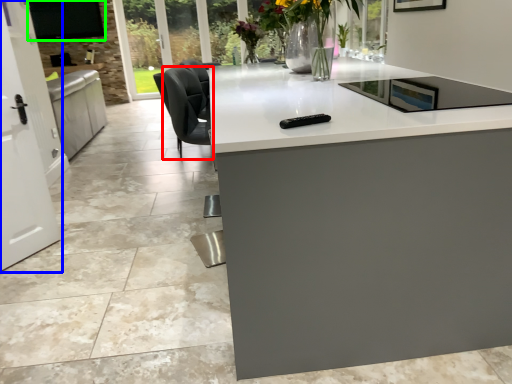
Question: Based on their relative distances, which object is nearer to swivel chair (highlighted by a red box)? Choose from screen door (highlighted by a blue box) and window screen (highlighted by a green box).

Choices:
 (A) screen door
 (B) window screen

Answer: (A)